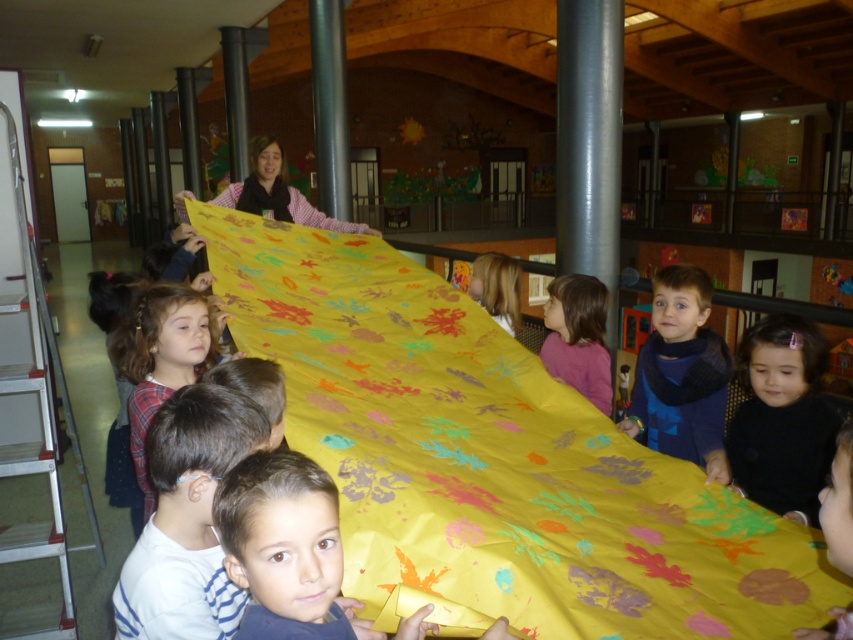
You are a photographer standing in the scene. You want to take a photo of the blue knitted scarf at center without the black matte hairband at lower right blocking it. Where should you move to ensure the hairband is not in the way?

Move to the left side of the scene so that the black matte hairband at lower right is no longer in front of the blue knitted scarf at center.

You are a teacher in the classroom. You want to hang a small decoration on the blue knitted scarf at center. The point where you need to hang it is at coordinate point (682, 374). Is this point on the blue knitted scarf at center?

Yes, the point (682, 374) is on the blue knitted scarf at center as stated in the objects description.